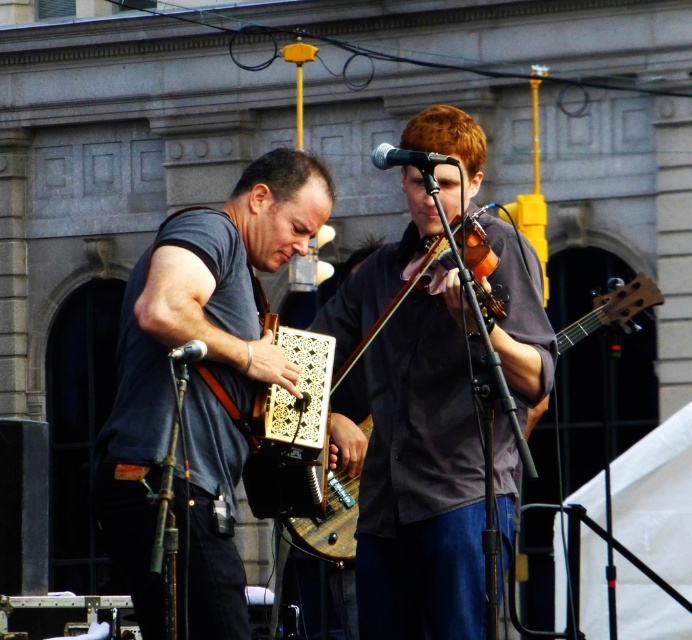
Does gray matte accordion at center appear over wooden acoustic guitar at center?

Yes.

Based on the photo, who is more forward, (118,369) or (286,522)?

Point (118,369) is more forward.

Where is `gray matte accordion at center`? gray matte accordion at center is located at coordinates (197, 337).

Between matte gray shirt at center and wooden acoustic guitar at center, which one appears on the left side from the viewer's perspective?

Positioned to the left is matte gray shirt at center.

The height and width of the screenshot is (640, 692). Describe the element at coordinates (419, 480) in the screenshot. I see `matte gray shirt at center` at that location.

You are a GUI agent. You are given a task and a screenshot of the screen. Output one action in this format:
    pyautogui.click(x=<x>, y=<y>)
    Task: Click on the matte gray shirt at center
    The height and width of the screenshot is (640, 692).
    Given the screenshot: What is the action you would take?
    pyautogui.click(x=419, y=480)

Measure the distance between matte gray shirt at center and gray matte accordion at center.

A distance of 3.94 meters exists between matte gray shirt at center and gray matte accordion at center.

Locate an element on the screen. matte gray shirt at center is located at coordinates (419, 480).